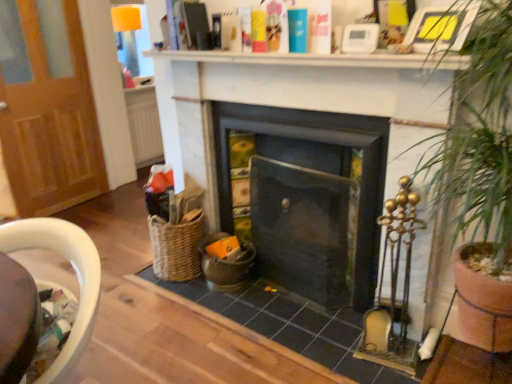
Question: Is point (426, 41) closer or farther from the camera than point (369, 54)?

Choices:
 (A) farther
 (B) closer

Answer: (B)

Question: Is yellow paper picture frame at upper right wider or thinner than white matte shelf at upper center?

Choices:
 (A) thin
 (B) wide

Answer: (A)

Question: Which object is the farthest from the white matte shelf at upper center?

Choices:
 (A) yellow paper picture frame at upper right
 (B) woven brown basket at lower left
 (C) dark gray stone fireplace at center, the second fireplace when ordered from left to right
 (D) green leafy plant at right
 (E) wooden door at left

Answer: (E)

Question: Based on their relative distances, which object is farther from the green leafy plant at right?

Choices:
 (A) woven brown basket at lower left
 (B) dark gray stone fireplace at center, the second fireplace when ordered from left to right
 (C) white matte shelf at upper center
 (D) yellow paper picture frame at upper right
 (E) wooden door at left

Answer: (E)